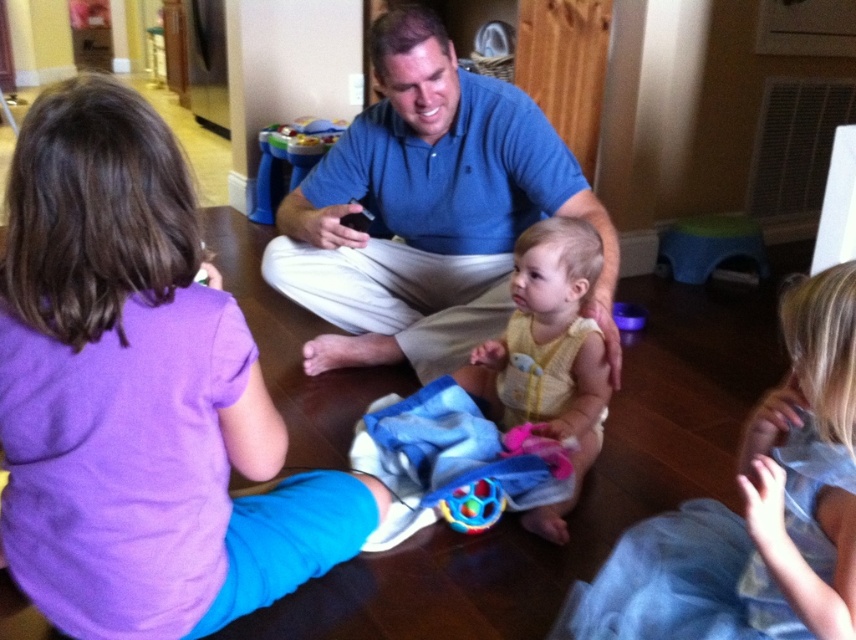
Is blue cotton shirt at center smaller than yellow knitted vest at center?

No.

In order to click on blue cotton shirt at center in this screenshot , I will do `click(428, 211)`.

Can you confirm if blue cotton shirt at center is smaller than rubberized plastic ball at center?

No.

The image size is (856, 640). Describe the element at coordinates (428, 211) in the screenshot. I see `blue cotton shirt at center` at that location.

Locate an element on the screen. This screenshot has height=640, width=856. blue cotton shirt at center is located at coordinates (428, 211).

Identify the location of light yellow knit sweater at lower right. The height and width of the screenshot is (640, 856). (755, 509).

Who is positioned more to the right, light yellow knit sweater at lower right or yellow knitted vest at center?

light yellow knit sweater at lower right is more to the right.

Is point (791, 470) positioned in front of point (485, 397)?

Yes, it is.

Find the location of a particular element. The width and height of the screenshot is (856, 640). light yellow knit sweater at lower right is located at coordinates (755, 509).